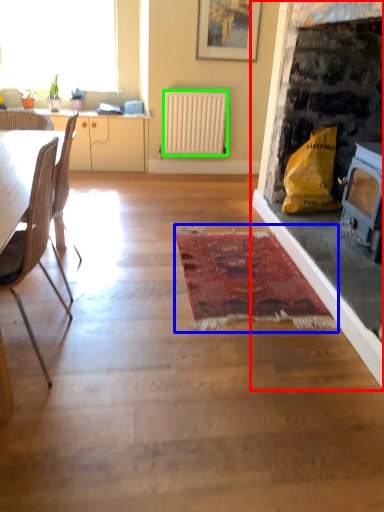
Question: Based on their relative distances, which object is nearer to fireplace (highlighted by a red box)? Choose from mat (highlighted by a blue box) and radiator (highlighted by a green box).

Choices:
 (A) mat
 (B) radiator

Answer: (A)